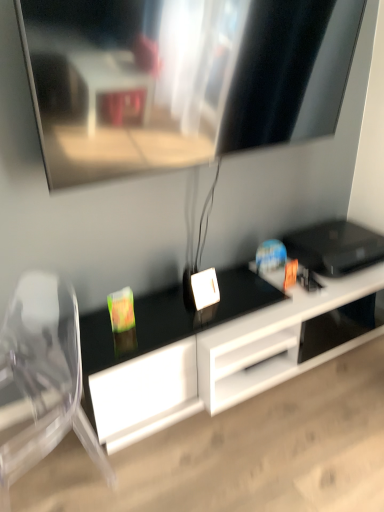
Describe the element at coordinates (213, 351) in the screenshot. I see `black glossy desk at center` at that location.

Find the location of a particular element. black glossy desk at center is located at coordinates (213, 351).

The width and height of the screenshot is (384, 512). Describe the element at coordinates (41, 379) in the screenshot. I see `transparent plastic swivel chair at left` at that location.

You are a GUI agent. You are given a task and a screenshot of the screen. Output one action in this format:
    pyautogui.click(x=<x>, y=<y>)
    Task: Click on the transparent plastic swivel chair at left
    
    Given the screenshot: What is the action you would take?
    pyautogui.click(x=41, y=379)

Locate an element on the screen. This screenshot has width=384, height=512. black glossy desk at center is located at coordinates (213, 351).

Considering the positions of objects transparent plastic swivel chair at left and black glossy desk at center in the image provided, who is more to the right, transparent plastic swivel chair at left or black glossy desk at center?

From the viewer's perspective, black glossy desk at center appears more on the right side.

Considering their positions, is transparent plastic swivel chair at left located in front of or behind black glossy desk at center?

transparent plastic swivel chair at left is in front of black glossy desk at center.

Is point (32, 291) closer to camera compared to point (146, 372)?

That is False.

From the image's perspective, is transparent plastic swivel chair at left positioned above or below black glossy desk at center?

Based on their image positions, transparent plastic swivel chair at left is located beneath black glossy desk at center.

From a real-world perspective, is transparent plastic swivel chair at left under black glossy desk at center?

No, from a real-world perspective, transparent plastic swivel chair at left is not beneath black glossy desk at center.

Is transparent plastic swivel chair at left wider than black glossy desk at center?

No, transparent plastic swivel chair at left is not wider than black glossy desk at center.

Considering the relative sizes of transparent plastic swivel chair at left and black glossy desk at center in the image provided, is transparent plastic swivel chair at left taller than black glossy desk at center?

Yes, transparent plastic swivel chair at left is taller than black glossy desk at center.

Based on their sizes in the image, would you say transparent plastic swivel chair at left is bigger or smaller than black glossy desk at center?

Considering their sizes, transparent plastic swivel chair at left takes up less space than black glossy desk at center.

Is black glossy desk at center surrounded by transparent plastic swivel chair at left?

No, black glossy desk at center is located outside of transparent plastic swivel chair at left.

Based on the photo, is transparent plastic swivel chair at left in contact with black glossy desk at center?

There is a gap between transparent plastic swivel chair at left and black glossy desk at center.

Is transparent plastic swivel chair at left aimed at black glossy desk at center?

No, transparent plastic swivel chair at left is not turned towards black glossy desk at center.

How different are the orientations of transparent plastic swivel chair at left and black glossy desk at center in degrees?

The angle between the facing direction of transparent plastic swivel chair at left and the facing direction of black glossy desk at center is 65.5 degrees.

Find the location of a particular element. The height and width of the screenshot is (512, 384). swivel chair above the black glossy desk at center (from a real-world perspective) is located at coordinates (x=41, y=379).

Does black glossy desk at center appear on the right side of transparent plastic swivel chair at left?

Indeed, black glossy desk at center is positioned on the right side of transparent plastic swivel chair at left.

In the image, is black glossy desk at center positioned in front of or behind transparent plastic swivel chair at left?

Visually, black glossy desk at center is located behind transparent plastic swivel chair at left.

Considering the points (95, 315) and (61, 310), which point is behind, point (95, 315) or point (61, 310)?

The point (61, 310) is behind.

From the image's perspective, which one is positioned lower, black glossy desk at center or transparent plastic swivel chair at left?

transparent plastic swivel chair at left is shown below in the image.

From a real-world perspective, is black glossy desk at center physically below transparent plastic swivel chair at left?

Yes, from a real-world perspective, black glossy desk at center is beneath transparent plastic swivel chair at left.

In terms of width, does black glossy desk at center look wider or thinner when compared to transparent plastic swivel chair at left?

Considering their sizes, black glossy desk at center looks broader than transparent plastic swivel chair at left.

Looking at this image, between black glossy desk at center and transparent plastic swivel chair at left, which one has more height?

transparent plastic swivel chair at left is taller.

Considering the sizes of objects black glossy desk at center and transparent plastic swivel chair at left in the image provided, who is smaller, black glossy desk at center or transparent plastic swivel chair at left?

transparent plastic swivel chair at left.

Is transparent plastic swivel chair at left inside black glossy desk at center?

No, black glossy desk at center does not contain transparent plastic swivel chair at left.

Are black glossy desk at center and transparent plastic swivel chair at left far apart?

Actually, black glossy desk at center and transparent plastic swivel chair at left are a little close together.

Does black glossy desk at center turn towards transparent plastic swivel chair at left?

No, black glossy desk at center is not facing towards transparent plastic swivel chair at left.

Image resolution: width=384 pixels, height=512 pixels. In the image, there is a black glossy desk at center. Identify the location of swivel chair below it (from the image's perspective). (41, 379).

At what (x,y) coordinates should I click in order to perform the action: click on desk behind the transparent plastic swivel chair at left. Please return your answer as a coordinate pair (x, y). This screenshot has width=384, height=512. Looking at the image, I should click on (213, 351).

This screenshot has height=512, width=384. What are the coordinates of `desk located underneath the transparent plastic swivel chair at left (from a real-world perspective)` in the screenshot? It's located at (213, 351).